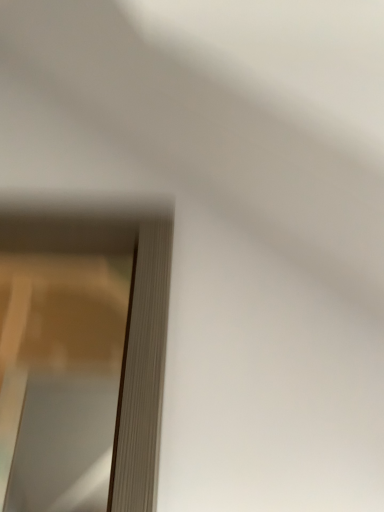
I want to click on matte glass window at left, so click(x=82, y=359).

Describe the element at coordinates (82, 359) in the screenshot. The image size is (384, 512). I see `matte glass window at left` at that location.

This screenshot has height=512, width=384. I want to click on matte glass window at left, so click(82, 359).